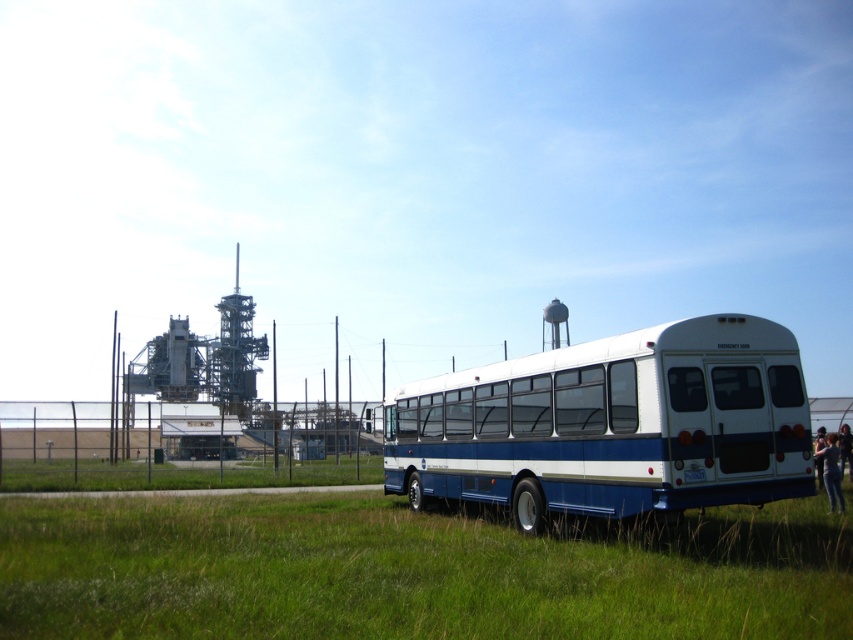
What do you see at coordinates (413, 572) in the screenshot? This screenshot has height=640, width=853. I see `green grass at lower center` at bounding box center [413, 572].

Does point (543, 538) lie behind point (685, 328)?

That is True.

Locate an element on the screen. This screenshot has height=640, width=853. green grass at lower center is located at coordinates (413, 572).

This screenshot has width=853, height=640. What are the coordinates of `green grass at lower center` in the screenshot? It's located at (413, 572).